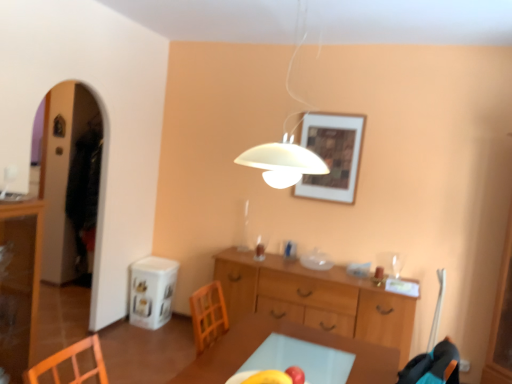
Question: Is wooden cabinet at center surrounding yellow matte apple at center?

Choices:
 (A) yes
 (B) no

Answer: (B)

Question: From the image's perspective, would you say wooden cabinet at center is positioned over yellow matte apple at center?

Choices:
 (A) no
 (B) yes

Answer: (A)

Question: From a real-world perspective, is wooden cabinet at center located higher than yellow matte apple at center?

Choices:
 (A) no
 (B) yes

Answer: (A)

Question: Is wooden cabinet at center positioned with its back to yellow matte apple at center?

Choices:
 (A) no
 (B) yes

Answer: (A)

Question: Is wooden cabinet at center wider than yellow matte apple at center?

Choices:
 (A) no
 (B) yes

Answer: (B)

Question: Considering the relative sizes of wooden cabinet at center and yellow matte apple at center in the image provided, is wooden cabinet at center bigger than yellow matte apple at center?

Choices:
 (A) no
 (B) yes

Answer: (B)

Question: From a real-world perspective, is light brown wooden table at center positioned over wooden framed artwork at upper center based on gravity?

Choices:
 (A) no
 (B) yes

Answer: (A)

Question: Is light brown wooden table at center behind wooden framed artwork at upper center?

Choices:
 (A) no
 (B) yes

Answer: (A)

Question: Is light brown wooden table at center taller than wooden framed artwork at upper center?

Choices:
 (A) no
 (B) yes

Answer: (A)

Question: From the image's perspective, is light brown wooden table at center over wooden framed artwork at upper center?

Choices:
 (A) no
 (B) yes

Answer: (A)

Question: Is light brown wooden table at center positioned before wooden framed artwork at upper center?

Choices:
 (A) yes
 (B) no

Answer: (A)

Question: Considering the relative positions of light brown wooden table at center and wooden framed artwork at upper center in the image provided, is light brown wooden table at center to the left of wooden framed artwork at upper center from the viewer's perspective?

Choices:
 (A) yes
 (B) no

Answer: (A)

Question: Is the depth of yellow matte apple at center greater than that of wooden cabinet at center?

Choices:
 (A) no
 (B) yes

Answer: (A)